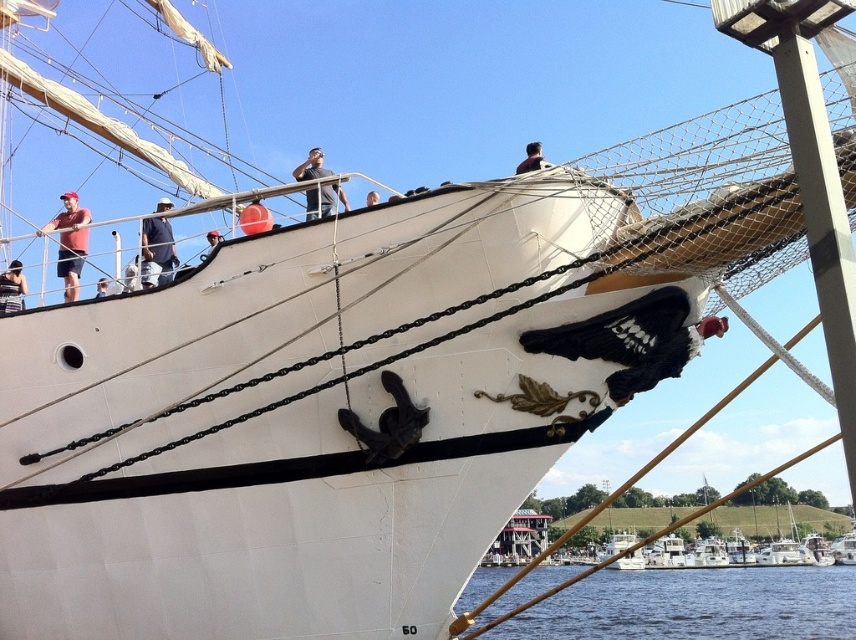
Consider the image. Between dark blue jeans at upper left and red helmet at upper center, which one has less height?

With less height is red helmet at upper center.

I want to click on dark blue jeans at upper left, so click(156, 252).

Is point (627, 632) in front of point (147, 259)?

No, (627, 632) is further to viewer.

Is point (574, 600) behind point (149, 284)?

Yes.

What do you see at coordinates (694, 605) in the screenshot?
I see `transparent water at lower right` at bounding box center [694, 605].

The image size is (856, 640). I want to click on transparent water at lower right, so click(x=694, y=605).

Who is positioned more to the right, dark brown hair at upper center or light blue shirt at upper center?

dark brown hair at upper center

In the scene shown: Can you confirm if dark brown hair at upper center is shorter than light blue shirt at upper center?

No.

Between point (526, 164) and point (367, 195), which one is positioned in front?

Positioned in front is point (526, 164).

This screenshot has width=856, height=640. I want to click on dark brown hair at upper center, so click(x=531, y=157).